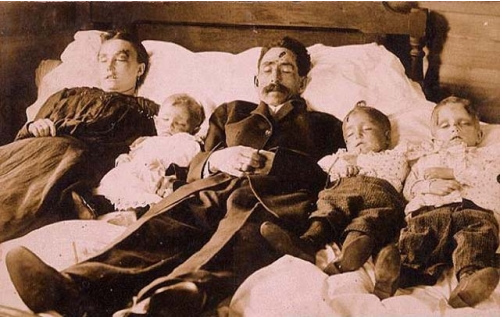
Locate an element on the screen. This screenshot has height=320, width=502. wooden wall is located at coordinates (474, 40).